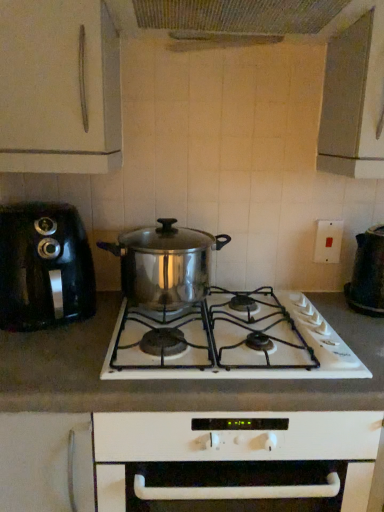
Question: Considering the relative sizes of white matte countertop at center and stainless steel pot at center in the image provided, is white matte countertop at center wider than stainless steel pot at center?

Choices:
 (A) no
 (B) yes

Answer: (B)

Question: Could you tell me if white matte countertop at center is turned towards stainless steel pot at center?

Choices:
 (A) no
 (B) yes

Answer: (A)

Question: Is white matte countertop at center shorter than stainless steel pot at center?

Choices:
 (A) no
 (B) yes

Answer: (A)

Question: From the image's perspective, is white matte countertop at center under stainless steel pot at center?

Choices:
 (A) no
 (B) yes

Answer: (B)

Question: Is white matte countertop at center positioned with its back to stainless steel pot at center?

Choices:
 (A) yes
 (B) no

Answer: (B)

Question: From a real-world perspective, is black plastic kettle at right, the 1th kitchen appliance viewed from the right, positioned above or below black plastic toaster at left, which ranks as the 2th kitchen appliance in right-to-left order?

Choices:
 (A) below
 (B) above

Answer: (A)

Question: Would you say black plastic kettle at right, the 1th kitchen appliance viewed from the right, is to the left or to the right of black plastic toaster at left, acting as the 1th kitchen appliance starting from the left, in the picture?

Choices:
 (A) left
 (B) right

Answer: (B)

Question: Is black plastic kettle at right, the 1th kitchen appliance viewed from the right, inside or outside of black plastic toaster at left, acting as the 1th kitchen appliance starting from the left?

Choices:
 (A) outside
 (B) inside

Answer: (A)

Question: Considering the positions of black plastic kettle at right, the 1th kitchen appliance viewed from the right, and black plastic toaster at left, acting as the 1th kitchen appliance starting from the left, in the image, is black plastic kettle at right, the 1th kitchen appliance viewed from the right, taller or shorter than black plastic toaster at left, acting as the 1th kitchen appliance starting from the left,?

Choices:
 (A) short
 (B) tall

Answer: (A)

Question: Considering the positions of white matte countertop at center and stainless steel pot at center in the image, is white matte countertop at center wider or thinner than stainless steel pot at center?

Choices:
 (A) wide
 (B) thin

Answer: (A)

Question: In the image, is white matte countertop at center positioned in front of or behind stainless steel pot at center?

Choices:
 (A) behind
 (B) front

Answer: (B)

Question: Is point (x=349, y=391) positioned closer to the camera than point (x=187, y=283)?

Choices:
 (A) farther
 (B) closer

Answer: (B)

Question: From a real-world perspective, is white matte countertop at center physically located above or below stainless steel pot at center?

Choices:
 (A) below
 (B) above

Answer: (A)

Question: Is stainless steel pot at center situated inside black plastic kettle at right, the 1th kitchen appliance viewed from the right, or outside?

Choices:
 (A) inside
 (B) outside

Answer: (B)

Question: Looking at their shapes, would you say stainless steel pot at center is wider or thinner than black plastic kettle at right, which is the 2th kitchen appliance in left-to-right order?

Choices:
 (A) wide
 (B) thin

Answer: (A)